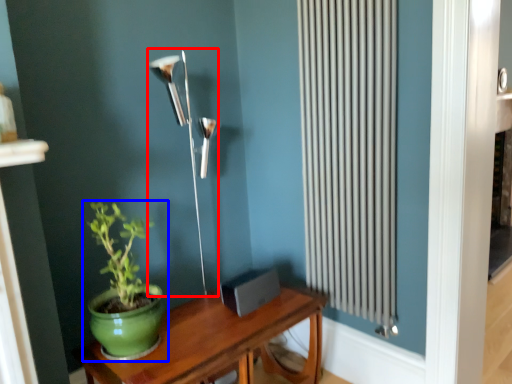
Question: Among these objects, which one is farthest to the camera, lamp (highlighted by a red box) or houseplant (highlighted by a blue box)?

Choices:
 (A) lamp
 (B) houseplant

Answer: (A)